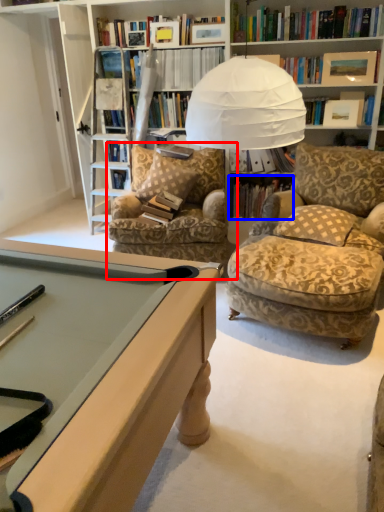
Question: Which object appears farthest to the camera in this image, chair (highlighted by a red box) or book (highlighted by a blue box)?

Choices:
 (A) chair
 (B) book

Answer: (B)